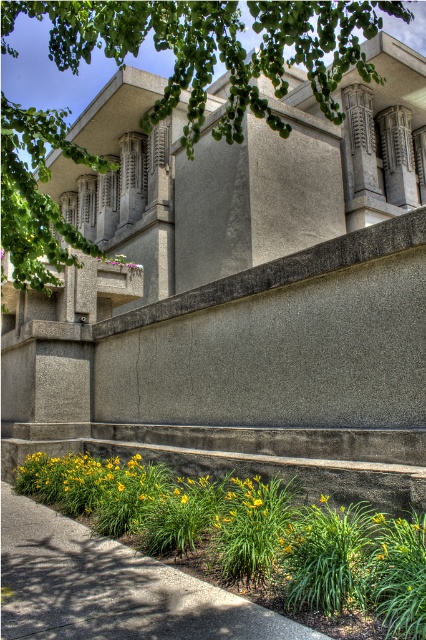
Question: Estimate the real-world distances between objects in this image. Which object is closer to the green leafy tree at upper center?

Choices:
 (A) purple matte flower at upper center
 (B) green grass at lower left

Answer: (A)

Question: Considering the relative positions of green grass at lower left and purple matte flower at upper center in the image provided, where is green grass at lower left located with respect to purple matte flower at upper center?

Choices:
 (A) left
 (B) right

Answer: (B)

Question: Does green leafy tree at upper center appear on the right side of purple matte flower at upper center?

Choices:
 (A) no
 (B) yes

Answer: (B)

Question: Which point is farther to the camera?

Choices:
 (A) purple matte flower at upper center
 (B) green leafy tree at upper center

Answer: (A)

Question: Considering the relative positions of green leafy tree at upper center and purple matte flower at upper center in the image provided, where is green leafy tree at upper center located with respect to purple matte flower at upper center?

Choices:
 (A) below
 (B) above

Answer: (B)

Question: Among these objects, which one is farthest from the camera?

Choices:
 (A) purple matte flower at upper center
 (B) green leafy tree at upper center
 (C) green grass at lower left

Answer: (A)